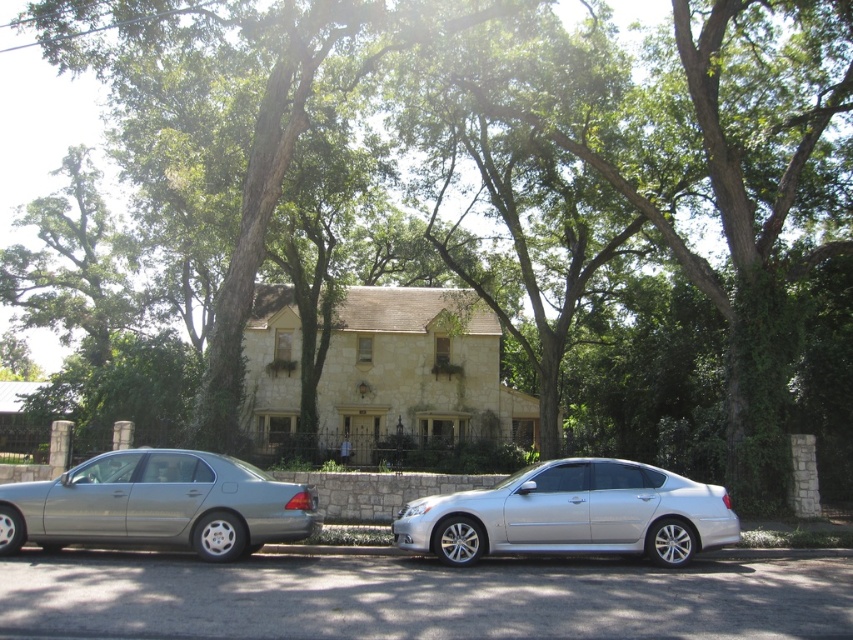
Question: Among these points, which one is farthest from the camera?

Choices:
 (A) (202, 522)
 (B) (529, 545)

Answer: (B)

Question: Which point is farther to the camera?

Choices:
 (A) (534, 490)
 (B) (166, 458)

Answer: (B)

Question: Is silver metallic sedan at center positioned at the back of satin silver sedan at left?

Choices:
 (A) no
 (B) yes

Answer: (B)

Question: Can you confirm if silver metallic sedan at center is wider than satin silver sedan at left?

Choices:
 (A) yes
 (B) no

Answer: (A)

Question: Is silver metallic sedan at center closer to the viewer compared to satin silver sedan at left?

Choices:
 (A) no
 (B) yes

Answer: (A)